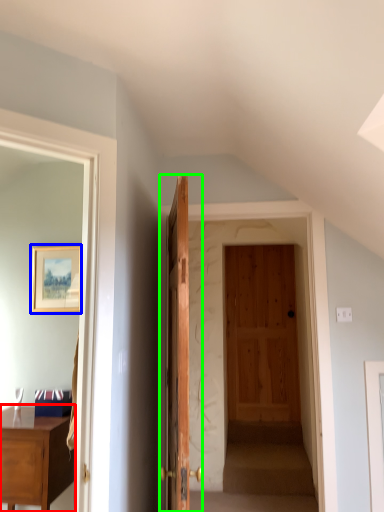
Question: Which is farther away from desk (highlighted by a red box)? picture frame (highlighted by a blue box) or door (highlighted by a green box)?

Choices:
 (A) picture frame
 (B) door

Answer: (A)